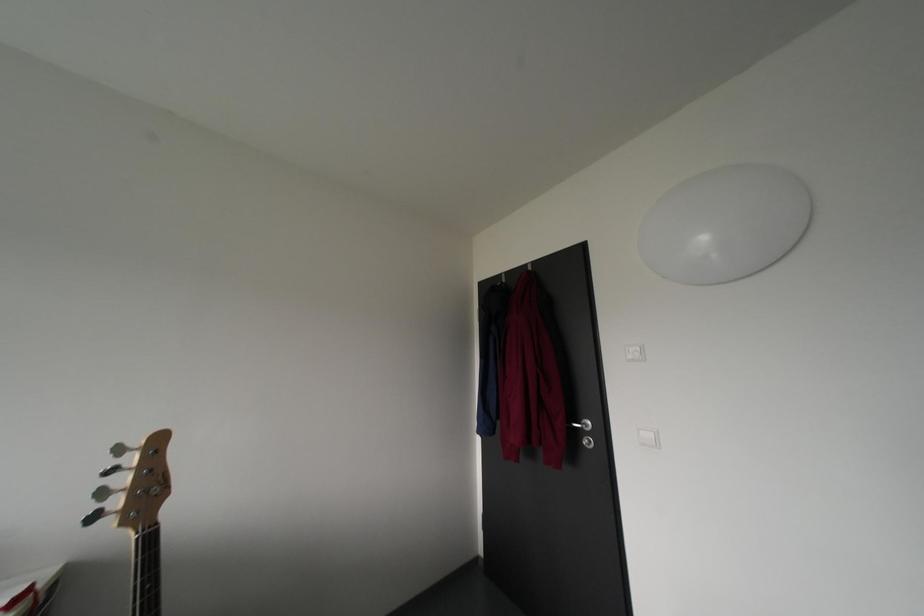
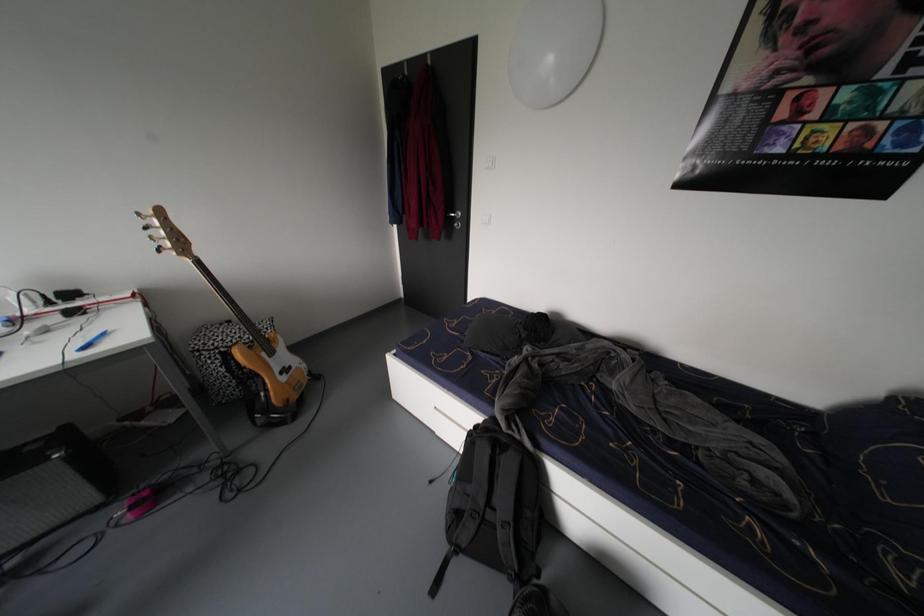
Based on the photo, based on the continuous images, in which direction is the camera rotating?

The rotation direction of the camera is right-down.